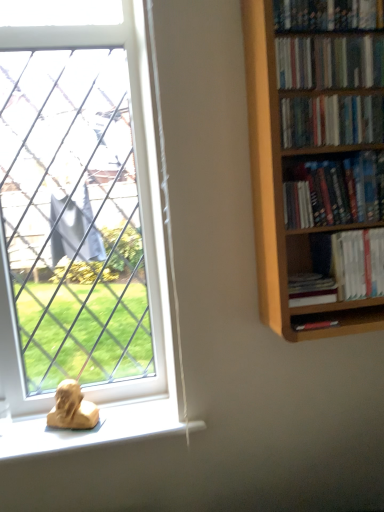
Question: Considering the relative sizes of hardcover book at right, which is counted as the 1th book, starting from the bottom, and white paperbacks at center-right, which is counted as the fifth book, starting from the top, in the image provided, is hardcover book at right, which is counted as the 1th book, starting from the bottom, shorter than white paperbacks at center-right, which is counted as the fifth book, starting from the top,?

Choices:
 (A) yes
 (B) no

Answer: (A)

Question: Does hardcover book at right, arranged as the sixth book when viewed from the top, have a lesser width compared to white paperbacks at center-right, the second book when ordered from bottom to top?

Choices:
 (A) no
 (B) yes

Answer: (A)

Question: Is hardcover book at right, arranged as the sixth book when viewed from the top, far away from white paperbacks at center-right, which is counted as the fifth book, starting from the top?

Choices:
 (A) no
 (B) yes

Answer: (A)

Question: Is hardcover book at right, which is counted as the 1th book, starting from the bottom, outside white paperbacks at center-right, which is counted as the fifth book, starting from the top?

Choices:
 (A) no
 (B) yes

Answer: (B)

Question: From a real-world perspective, is hardcover book at right, arranged as the sixth book when viewed from the top, physically below white paperbacks at center-right, which is counted as the fifth book, starting from the top?

Choices:
 (A) yes
 (B) no

Answer: (A)

Question: Is hardcover book at right, arranged as the sixth book when viewed from the top, positioned in front of white paperbacks at center-right, the second book when ordered from bottom to top?

Choices:
 (A) no
 (B) yes

Answer: (B)

Question: Does white paperbacks at center-right, which is counted as the fifth book, starting from the top, appear on the right side of white plastic window at lower left?

Choices:
 (A) yes
 (B) no

Answer: (A)

Question: Is white paperbacks at center-right, the second book when ordered from bottom to top, closer to the viewer compared to white plastic window at lower left?

Choices:
 (A) no
 (B) yes

Answer: (B)

Question: Does white paperbacks at center-right, the second book when ordered from bottom to top, have a greater height compared to white plastic window at lower left?

Choices:
 (A) yes
 (B) no

Answer: (B)

Question: Considering the relative sizes of white paperbacks at center-right, which is counted as the fifth book, starting from the top, and white plastic window at lower left in the image provided, is white paperbacks at center-right, which is counted as the fifth book, starting from the top, thinner than white plastic window at lower left?

Choices:
 (A) yes
 (B) no

Answer: (A)

Question: Can we say white paperbacks at center-right, the second book when ordered from bottom to top, lies outside white plastic window at lower left?

Choices:
 (A) yes
 (B) no

Answer: (A)

Question: Does white paperbacks at center-right, which is counted as the fifth book, starting from the top, have a larger size compared to white plastic window at lower left?

Choices:
 (A) yes
 (B) no

Answer: (B)

Question: Is hardcover books at upper right, acting as the 3th book starting from the top, closer to the viewer compared to white plastic window at lower left?

Choices:
 (A) no
 (B) yes

Answer: (B)